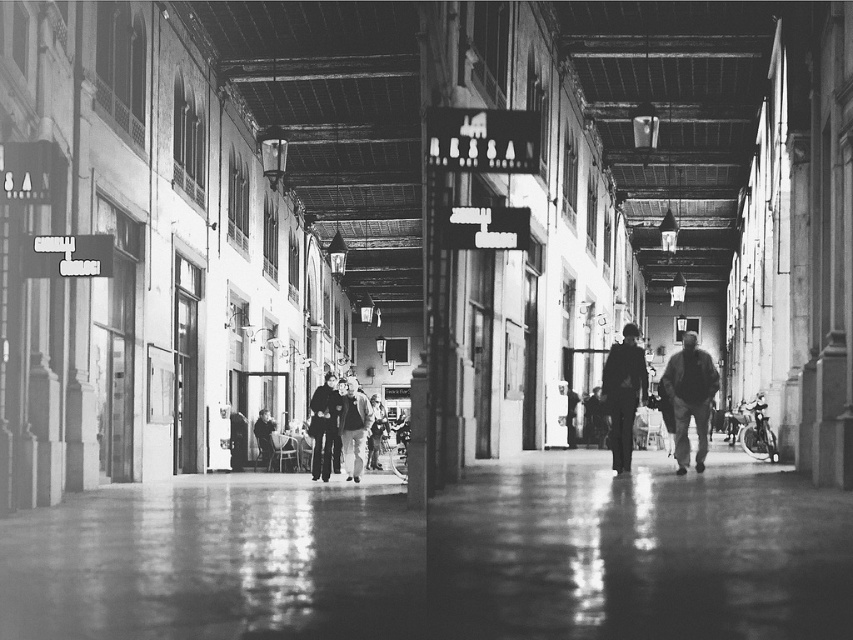
Question: Considering the relative positions of smooth leather jacket at center and dark blue jeans at center in the image provided, where is smooth leather jacket at center located with respect to dark blue jeans at center?

Choices:
 (A) right
 (B) left

Answer: (A)

Question: Does smooth leather jacket at center have a lesser width compared to dark blue jeans at center?

Choices:
 (A) yes
 (B) no

Answer: (A)

Question: Can you confirm if dark blue jeans at center is positioned to the left of matte black jacket at center?

Choices:
 (A) no
 (B) yes

Answer: (B)

Question: Which object is positioned farthest from the matte black jacket at center?

Choices:
 (A) dark blue jeans at center
 (B) smooth leather jacket at center
 (C) dark fabric coat at center

Answer: (B)

Question: Which of the following is the closest to the observer?

Choices:
 (A) (636, 401)
 (B) (322, 435)
 (C) (705, 456)
 (D) (366, 416)

Answer: (A)

Question: Which point appears farthest from the camera in this image?

Choices:
 (A) (321, 403)
 (B) (357, 474)
 (C) (606, 387)
 (D) (688, 397)

Answer: (A)